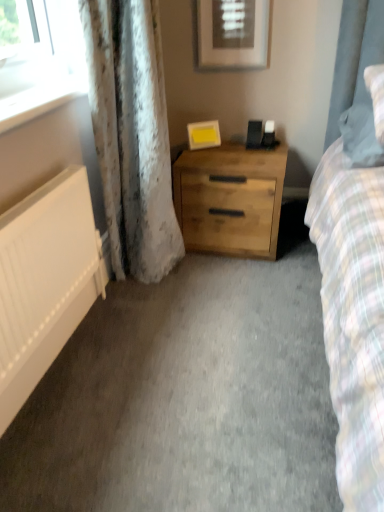
At what (x,y) coordinates should I click in order to perform the action: click on free space above white glossy window sill at upper left (from a real-world perspective). Please return your answer as a coordinate pair (x, y). This screenshot has width=384, height=512. Looking at the image, I should click on (42, 93).